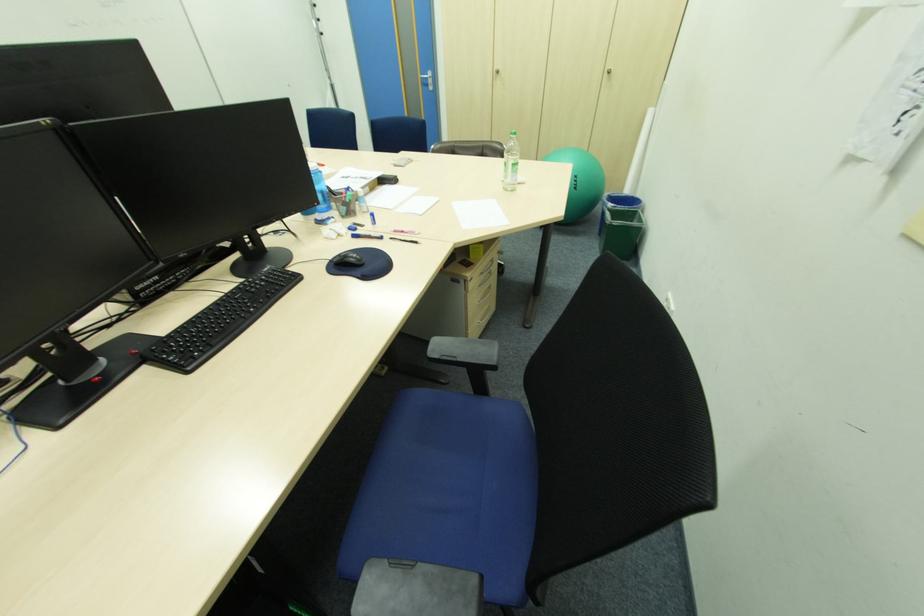
Which object does [347,259] point to?

It refers to a black computer mouse.